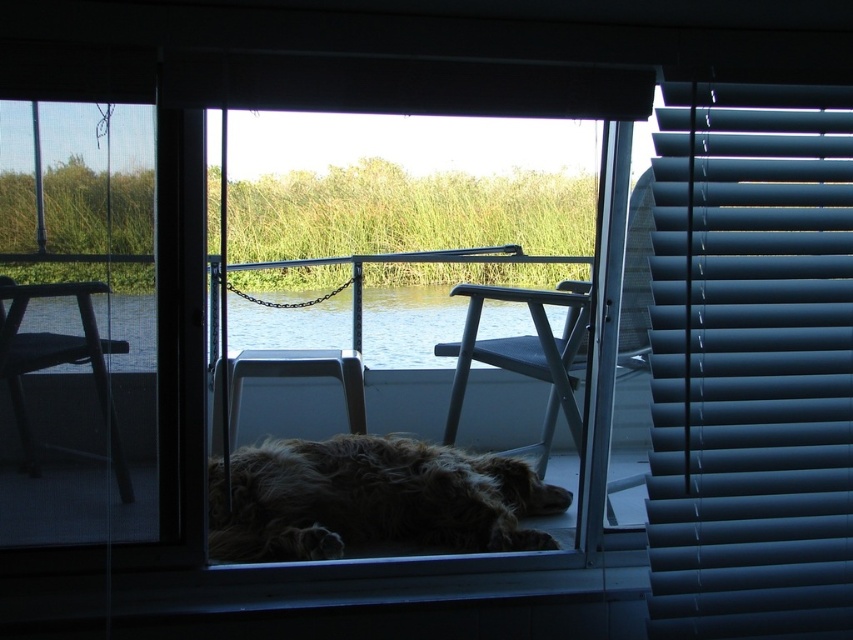
Question: Is fuzzy brown fur at center positioned in front of black plastic chair at left?

Choices:
 (A) no
 (B) yes

Answer: (A)

Question: Does matte blue blinds at right appear under black plastic chair at left?

Choices:
 (A) yes
 (B) no

Answer: (B)

Question: Estimate the real-world distances between objects in this image. Which object is farther from the wooden chair at center?

Choices:
 (A) fuzzy brown fur at center
 (B) matte plastic chair at center
 (C) matte blue blinds at right

Answer: (C)

Question: Which point appears closest to the camera in this image?

Choices:
 (A) (x=587, y=289)
 (B) (x=577, y=433)
 (C) (x=845, y=392)
 (D) (x=32, y=288)

Answer: (D)

Question: Which object is positioned closest to the clear water at center?

Choices:
 (A) matte blue blinds at right
 (B) matte plastic chair at center
 (C) metallic gray chair at center
 (D) wooden chair at center

Answer: (D)

Question: Can you confirm if fuzzy brown fur at center is positioned below metallic gray chair at center?

Choices:
 (A) no
 (B) yes

Answer: (B)